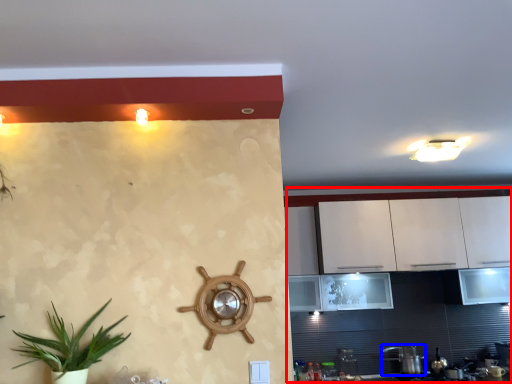
Question: Which point is further to the camera, dresser (highlighted by a red box) or appliance (highlighted by a blue box)?

Choices:
 (A) dresser
 (B) appliance

Answer: (B)